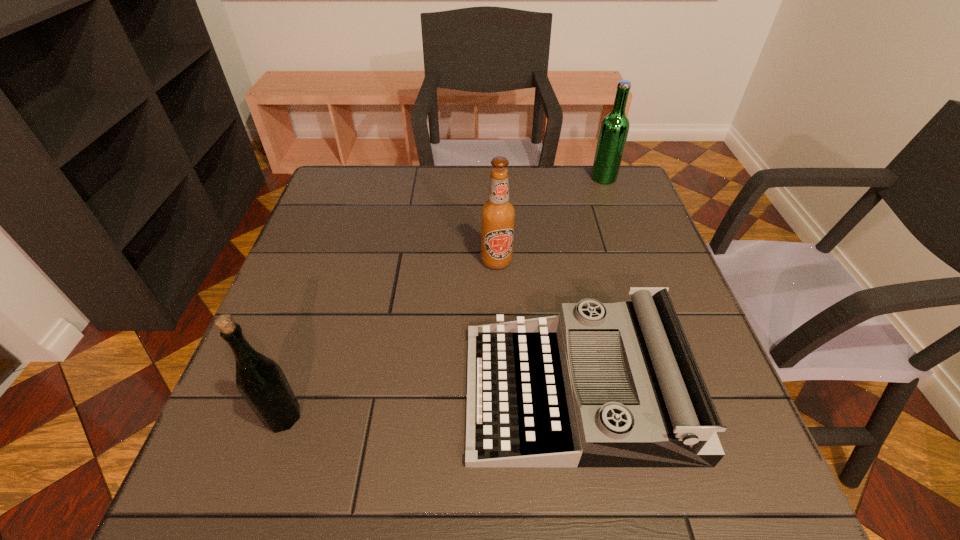
Identify the location of free location located 0.190m on the typing side of the typewriter. 368,392.

At what (x,y) coordinates should I click in order to perform the action: click on vacant space located 0.070m on the typing side of the typewriter. Please return your answer as a coordinate pair (x, y). This screenshot has width=960, height=540. Looking at the image, I should click on (430, 392).

At what (x,y) coordinates should I click in order to perform the action: click on free location located on the typing side of the typewriter. Please return your answer as a coordinate pair (x, y). The height and width of the screenshot is (540, 960). Looking at the image, I should click on (430, 392).

Where is `object positioned at the far edge`? Image resolution: width=960 pixels, height=540 pixels. object positioned at the far edge is located at coordinates (614, 129).

The height and width of the screenshot is (540, 960). Identify the location of object that is at the near edge. (601, 384).

The image size is (960, 540). I want to click on object located in the left edge section of the desktop, so click(261, 381).

Identify the location of beer bottle located in the right edge section of the desktop. Image resolution: width=960 pixels, height=540 pixels. (614, 129).

At what (x,y) coordinates should I click in order to perform the action: click on typewriter that is positioned at the right edge. Please return your answer as a coordinate pair (x, y). Looking at the image, I should click on (601, 384).

Where is `object located at the far right corner`? object located at the far right corner is located at coordinates (614, 129).

Find the location of `object that is at the near right corner`. object that is at the near right corner is located at coordinates (601, 384).